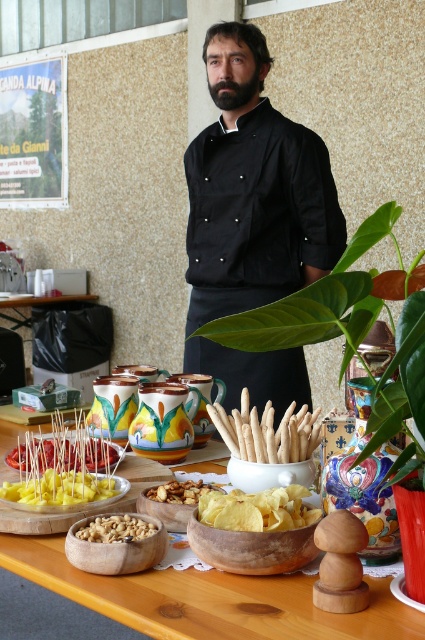
Who is higher up, black fabric chef at center or white matte asparagus at center?

Positioned higher is black fabric chef at center.

Which is more to the left, black fabric chef at center or white matte asparagus at center?

white matte asparagus at center is more to the left.

Between point (218, 77) and point (306, 435), which one is positioned in front?

Point (306, 435) is more forward.

This screenshot has height=640, width=425. What are the coordinates of `black fabric chef at center` in the screenshot? It's located at (254, 189).

Who is more distant from viewer, (25, 499) or (175, 490)?

Point (175, 490)

Which of these two, yellow cheese sticks at center or crunchy nuts at center, stands shorter?

With less height is crunchy nuts at center.

Which is behind, point (3, 490) or point (184, 496)?

Point (3, 490)

You are a GUI agent. You are given a task and a screenshot of the screen. Output one action in this format:
    pyautogui.click(x=<x>, y=<y>)
    Task: Click on the yellow cheese sticks at center
    The image size is (425, 640).
    Given the screenshot: What is the action you would take?
    pyautogui.click(x=59, y=488)

Which is in front, point (317, 212) or point (249, 528)?

Point (249, 528) is more forward.

This screenshot has width=425, height=640. What do you see at coordinates (254, 189) in the screenshot?
I see `black fabric chef at center` at bounding box center [254, 189].

Find the location of `black fabric chef at center`. black fabric chef at center is located at coordinates (254, 189).